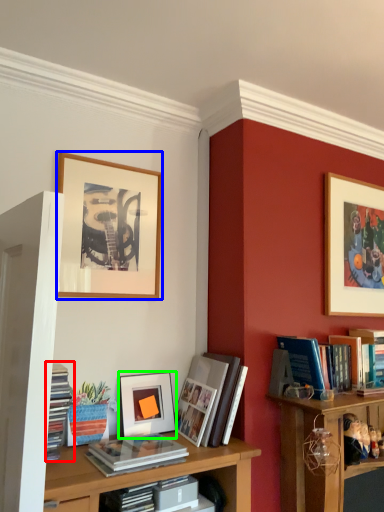
Question: Considering the real-world distances, which object is closest to book (highlighted by a red box)? picture frame (highlighted by a blue box) or picture frame (highlighted by a green box).

Choices:
 (A) picture frame
 (B) picture frame

Answer: (B)